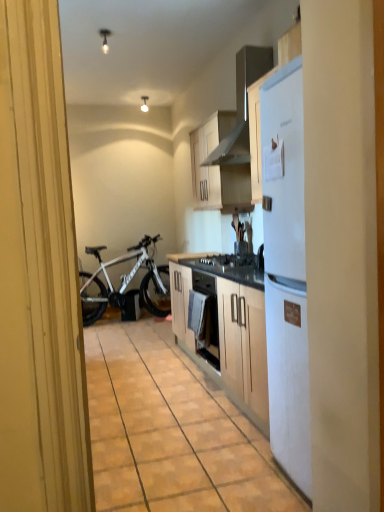
This screenshot has width=384, height=512. What do you see at coordinates (217, 169) in the screenshot?
I see `white matte cabinet at upper center` at bounding box center [217, 169].

What is the approximate width of metallic silver range hood at upper center?

It is 18.44 inches.

Locate an element on the screen. The image size is (384, 512). white glossy light bulb at upper center, the 2th lamp from the back is located at coordinates (105, 39).

Find the location of a particular element. This screenshot has height=512, width=384. white glossy lamp at upper center, placed as the 1th lamp when sorted from top to bottom is located at coordinates (144, 104).

Does metallic silver range hood at upper center come in front of white glossy light bulb at upper center, the 2th lamp from the back?

Yes, metallic silver range hood at upper center is in front of white glossy light bulb at upper center, the 2th lamp from the back.

Considering the sizes of metallic silver range hood at upper center and white glossy light bulb at upper center, the 1th lamp when ordered from left to right, in the image, is metallic silver range hood at upper center taller or shorter than white glossy light bulb at upper center, the 1th lamp when ordered from left to right,?

Considering their sizes, metallic silver range hood at upper center has more height than white glossy light bulb at upper center, the 1th lamp when ordered from left to right.

Is point (257, 68) less distant than point (109, 31)?

That is True.

Based on their sizes in the image, would you say metallic silver range hood at upper center is bigger or smaller than white glossy light bulb at upper center, positioned as the 1th lamp in front-to-back order?

metallic silver range hood at upper center is bigger than white glossy light bulb at upper center, positioned as the 1th lamp in front-to-back order.

Which object is further away from the camera taking this photo, white glossy light bulb at upper center, placed as the first lamp when sorted from bottom to top, or white glossy lamp at upper center, the second lamp in the front-to-back sequence?

white glossy lamp at upper center, the second lamp in the front-to-back sequence.

In the scene shown: From the image's perspective, which is below, white glossy light bulb at upper center, the 2th lamp from the back, or white glossy lamp at upper center, acting as the 2th lamp starting from the bottom?

white glossy light bulb at upper center, the 2th lamp from the back, is shown below in the image.

Considering the positions of point (105, 34) and point (145, 108), is point (105, 34) closer or farther from the camera than point (145, 108)?

Point (105, 34).

Considering the positions of objects white glossy light bulb at upper center, placed as the first lamp when sorted from bottom to top, and white glossy lamp at upper center, the 1th lamp positioned from the right, in the image provided, who is more to the right, white glossy light bulb at upper center, placed as the first lamp when sorted from bottom to top, or white glossy lamp at upper center, the 1th lamp positioned from the right,?

From the viewer's perspective, white glossy lamp at upper center, the 1th lamp positioned from the right, appears more on the right side.

Starting from the matte wood floor at center, which lamp is the 1st one to the left? Please provide its 2D coordinates.

[(144, 104)]

In the scene shown: Can you tell me how much matte wood floor at center and white glossy lamp at upper center, the second lamp in the front-to-back sequence, differ in facing direction?

matte wood floor at center and white glossy lamp at upper center, the second lamp in the front-to-back sequence, are facing 8.49 degrees away from each other.

From the picture: Which point is more distant from viewer, (102, 330) or (143, 101)?

The point (143, 101) is behind.

Is matte wood floor at center directly adjacent to white glossy lamp at upper center, the 1th lamp positioned from the right?

There is a gap between matte wood floor at center and white glossy lamp at upper center, the 1th lamp positioned from the right.

From the image's perspective, between white glossy lamp at upper center, the 1th lamp positioned from the right, and white glossy light bulb at upper center, placed as the first lamp when sorted from bottom to top, who is located below?

white glossy light bulb at upper center, placed as the first lamp when sorted from bottom to top, from the image's perspective.

Is white glossy light bulb at upper center, positioned as the 1th lamp in front-to-back order, a part of white glossy lamp at upper center, the second lamp in the front-to-back sequence?

No, white glossy light bulb at upper center, positioned as the 1th lamp in front-to-back order, is not a part of white glossy lamp at upper center, the second lamp in the front-to-back sequence.

Considering the sizes of objects white glossy lamp at upper center, placed as the 1th lamp when sorted from top to bottom, and white glossy light bulb at upper center, positioned as the 1th lamp in front-to-back order, in the image provided, who is smaller, white glossy lamp at upper center, placed as the 1th lamp when sorted from top to bottom, or white glossy light bulb at upper center, positioned as the 1th lamp in front-to-back order,?

white glossy light bulb at upper center, positioned as the 1th lamp in front-to-back order, is smaller.

How many degrees apart are the facing directions of white glossy lamp at upper center, placed as the 1th lamp when sorted from top to bottom, and white glossy light bulb at upper center, arranged as the second lamp when viewed from the top?

There is a 0.0036-degree angle between the facing directions of white glossy lamp at upper center, placed as the 1th lamp when sorted from top to bottom, and white glossy light bulb at upper center, arranged as the second lamp when viewed from the top.

Is white matte bicycle at left far away from white matte cabinet at upper center?

Yes, white matte bicycle at left is far from white matte cabinet at upper center.

Is white matte cabinet at upper center located within white matte bicycle at left?

Definitely not — white matte cabinet at upper center is not inside white matte bicycle at left.

The width and height of the screenshot is (384, 512). I want to click on cabinetry located above the white matte bicycle at left (from a real-world perspective), so click(217, 169).

Between point (139, 291) and point (202, 141), which one is positioned in front?

Positioned in front is point (202, 141).

Would you consider white matte bicycle at left to be distant from white glossy lamp at upper center, the second lamp in the front-to-back sequence?

→ Indeed, white matte bicycle at left is not near white glossy lamp at upper center, the second lamp in the front-to-back sequence.

Between point (166, 312) and point (142, 108), which one is positioned behind?

The point (142, 108) is more distant.

From a real-world perspective, is white matte bicycle at left beneath white glossy lamp at upper center, placed as the 1th lamp when sorted from top to bottom?

Correct, in the physical world, white matte bicycle at left is lower than white glossy lamp at upper center, placed as the 1th lamp when sorted from top to bottom.

Looking at this image, which of these two, white matte bicycle at left or white glossy lamp at upper center, the 1th lamp positioned from the right, is smaller?

Smaller between the two is white glossy lamp at upper center, the 1th lamp positioned from the right.

Who is taller, white matte cabinet at upper center or white glossy lamp at upper center, which ranks as the 2th lamp in left-to-right order?

Standing taller between the two is white matte cabinet at upper center.

Is white matte cabinet at upper center bigger or smaller than white glossy lamp at upper center, placed as the 1th lamp when sorted from top to bottom?

In the image, white matte cabinet at upper center appears to be larger than white glossy lamp at upper center, placed as the 1th lamp when sorted from top to bottom.

Identify the location of lamp that is the 1st object to the left of the white matte cabinet at upper center, starting at the anchor. Image resolution: width=384 pixels, height=512 pixels. (144, 104).

How much distance is there between white matte cabinet at upper center and white glossy lamp at upper center, the 1th lamp positioned from the right?

They are 9.24 feet apart.

In order to click on appliance below the white glossy light bulb at upper center, positioned as the 1th lamp in front-to-back order (from a real-world perspective) in this screenshot , I will do `click(242, 106)`.

Where is `lamp on the left of white glossy lamp at upper center, placed as the 1th lamp when sorted from top to bottom`? This screenshot has width=384, height=512. lamp on the left of white glossy lamp at upper center, placed as the 1th lamp when sorted from top to bottom is located at coordinates (105, 39).

Considering their positions, is white glossy light bulb at upper center, the second lamp positioned from the right, positioned closer to matte wood floor at center than white glossy lamp at upper center, placed as the 1th lamp when sorted from top to bottom?

white glossy light bulb at upper center, the second lamp positioned from the right, is positioned closer to the anchor matte wood floor at center.

From the picture: Looking at the image, which one is located further to white glossy lamp at upper center, which ranks as the 2th lamp in left-to-right order, white glossy light bulb at upper center, placed as the first lamp when sorted from bottom to top, or metallic silver range hood at upper center?

Answer: metallic silver range hood at upper center is further to white glossy lamp at upper center, which ranks as the 2th lamp in left-to-right order.

Based on the photo, estimate the real-world distances between objects in this image. Which object is further from white glossy light bulb at upper center, arranged as the second lamp when viewed from the top, white matte cabinet at upper center or white matte bicycle at left?

white matte bicycle at left is further to white glossy light bulb at upper center, arranged as the second lamp when viewed from the top.

When comparing their distances from metallic silver range hood at upper center, does white matte bicycle at left or white glossy light bulb at upper center, the 2th lamp from the back, seem further?

Among the two, white matte bicycle at left is located further to metallic silver range hood at upper center.

Based on their spatial positions, is matte wood floor at center or white glossy lamp at upper center, the second lamp in the front-to-back sequence, further from metallic silver range hood at upper center?

Based on the image, white glossy lamp at upper center, the second lamp in the front-to-back sequence, appears to be further to metallic silver range hood at upper center.

Estimate the real-world distances between objects in this image. Which object is further from matte wood floor at center, white matte cabinet at upper center or white matte bicycle at left?

Based on the image, white matte bicycle at left appears to be further to matte wood floor at center.

Based on their spatial positions, is metallic silver range hood at upper center or matte wood floor at center further from white glossy light bulb at upper center, placed as the first lamp when sorted from bottom to top?

Among the two, matte wood floor at center is located further to white glossy light bulb at upper center, placed as the first lamp when sorted from bottom to top.

Looking at this image, considering their positions, is metallic silver range hood at upper center positioned further to white matte cabinet at upper center than white matte bicycle at left?

Among the two, white matte bicycle at left is located further to white matte cabinet at upper center.

The image size is (384, 512). What are the coordinates of `cabinetry between matte wood floor at center and white matte bicycle at left along the z-axis` in the screenshot? It's located at coord(217,169).

Find the location of a particular element. This screenshot has width=384, height=512. cabinetry between white glossy light bulb at upper center, the 1th lamp when ordered from left to right, and matte wood floor at center from top to bottom is located at coordinates (217, 169).

The height and width of the screenshot is (512, 384). I want to click on cabinetry between white glossy lamp at upper center, placed as the 1th lamp when sorted from top to bottom, and white matte bicycle at left in the up-down direction, so click(x=217, y=169).

This screenshot has height=512, width=384. Find the location of `appliance between white glossy light bulb at upper center, the 1th lamp when ordered from left to right, and matte wood floor at center vertically`. appliance between white glossy light bulb at upper center, the 1th lamp when ordered from left to right, and matte wood floor at center vertically is located at coordinates (242, 106).